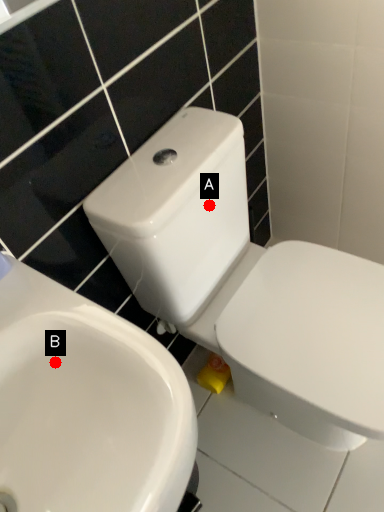
Question: Two points are circled on the image, labeled by A and B beside each circle. Which point appears farthest from the camera in this image?

Choices:
 (A) A is further
 (B) B is further

Answer: (A)